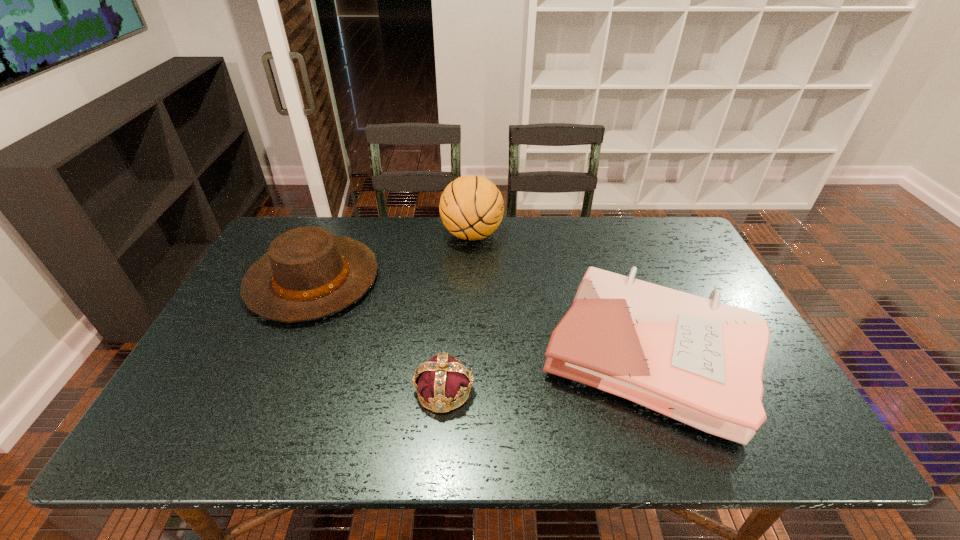
The image size is (960, 540). I want to click on vacant space at the far left corner, so click(323, 222).

Where is `vacant region at the near left corner of the desktop`? The width and height of the screenshot is (960, 540). vacant region at the near left corner of the desktop is located at coordinates (171, 427).

Where is `unoccupied position between the basketball and the second tallest object`? unoccupied position between the basketball and the second tallest object is located at coordinates (393, 257).

The width and height of the screenshot is (960, 540). I want to click on free space between the rightmost object and the crown, so click(546, 374).

Locate an element on the screen. empty location between the phonebook and the second tallest object is located at coordinates (481, 318).

Where is `free space between the second tallest object and the tallest object`? free space between the second tallest object and the tallest object is located at coordinates (393, 257).

This screenshot has height=540, width=960. In order to click on empty space between the cowboy hat and the crown in this screenshot , I will do `click(378, 335)`.

At what (x,y) coordinates should I click in order to perform the action: click on free area in between the crown and the basketball. Please return your answer as a coordinate pair (x, y). This screenshot has height=540, width=960. Looking at the image, I should click on (458, 313).

This screenshot has width=960, height=540. Find the location of `free space between the third shortest object and the crown`. free space between the third shortest object and the crown is located at coordinates (378, 335).

Find the location of a particular element. This screenshot has height=540, width=960. free space between the basketball and the crown is located at coordinates tap(458, 313).